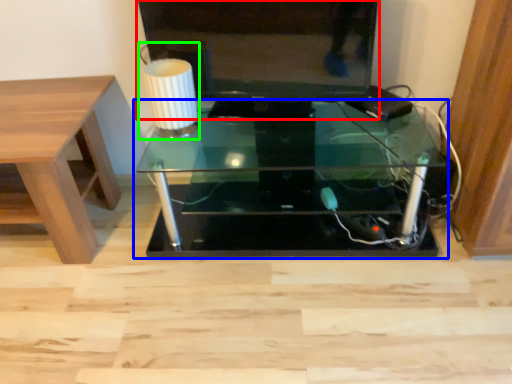
Question: Considering the real-world distances, which object is farthest from television (highlighted by a red box)? table (highlighted by a blue box) or table lamp (highlighted by a green box)?

Choices:
 (A) table
 (B) table lamp

Answer: (A)